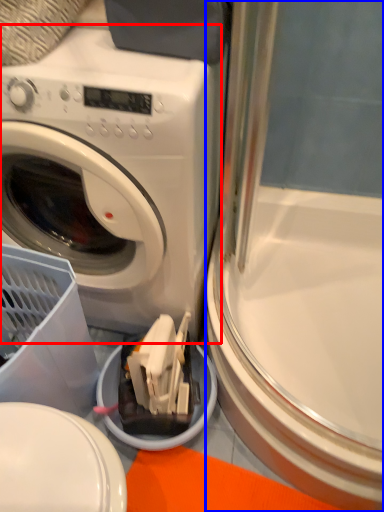
Question: Which object is further to the camera taking this photo, washing machine (highlighted by a red box) or screen door (highlighted by a blue box)?

Choices:
 (A) washing machine
 (B) screen door

Answer: (B)